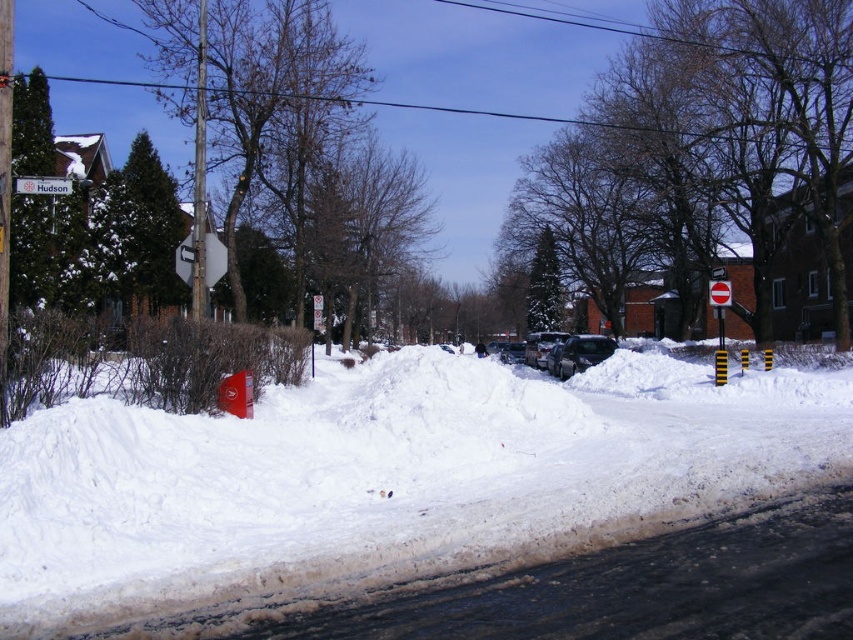
Question: Observing the image, what is the correct spatial positioning of shiny silver sedan at center in reference to white plastic street sign at upper left?

Choices:
 (A) left
 (B) right

Answer: (B)

Question: Which object is closer to the camera taking this photo?

Choices:
 (A) white fluffy snow at center
 (B) white plastic street sign at upper left
 (C) sleek black car at center

Answer: (A)

Question: Where is white fluffy snow at center located in relation to sleek black car at center in the image?

Choices:
 (A) below
 (B) above

Answer: (A)

Question: Which of the following is the closest to the observer?

Choices:
 (A) sleek black car at center
 (B) shiny silver sedan at center
 (C) white fluffy snow at center

Answer: (C)

Question: Is white fluffy snow at center to the right of sleek black car at center from the viewer's perspective?

Choices:
 (A) no
 (B) yes

Answer: (A)

Question: Which of the following is the closest to the observer?

Choices:
 (A) white fluffy snow at center
 (B) shiny silver sedan at center
 (C) white plastic street sign at upper left
 (D) sleek black car at center

Answer: (A)